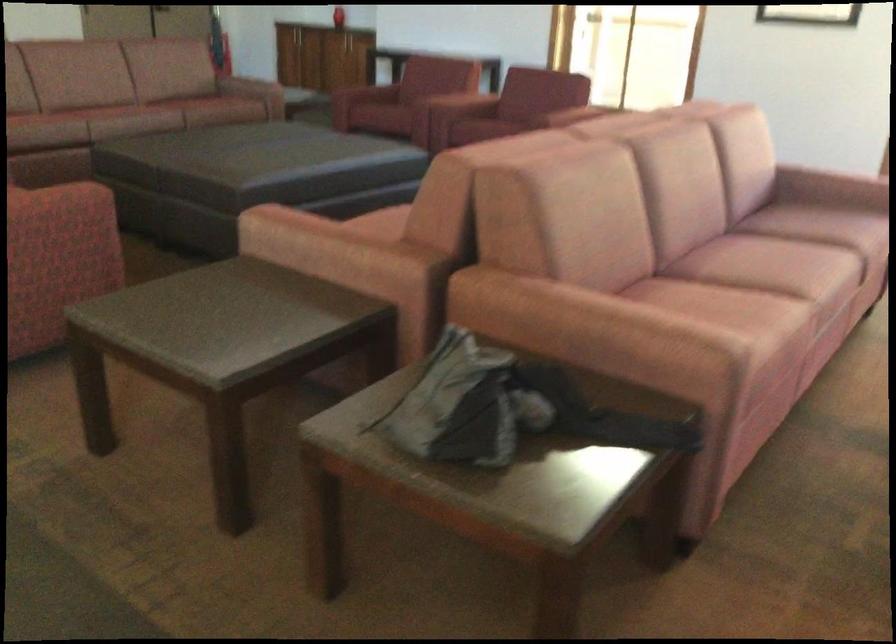
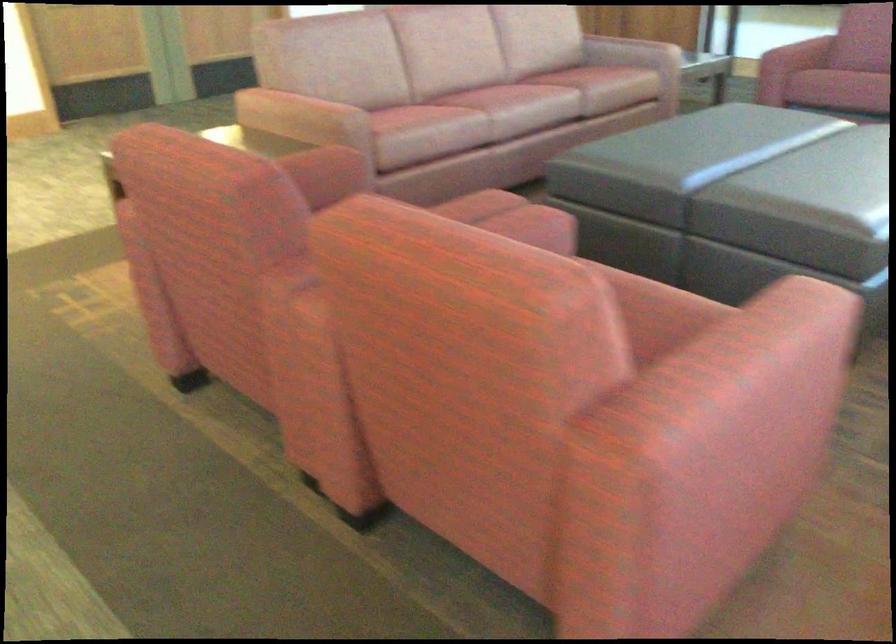
Based on the photo, the images are taken continuously from a first-person perspective. In which direction are you moving?

The movement direction of the cameraman is left, forward.